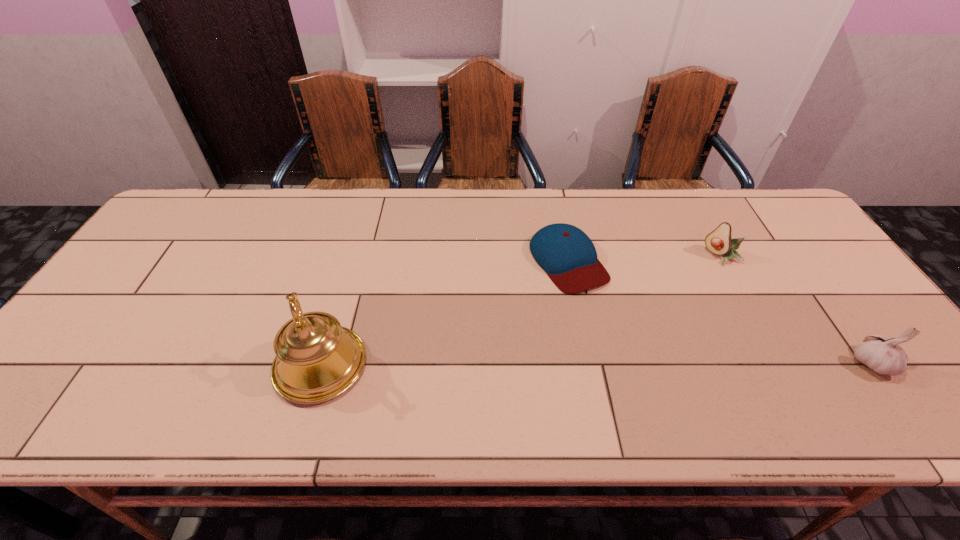
The width and height of the screenshot is (960, 540). I want to click on free location located on the seed side of the avocado, so click(669, 299).

The image size is (960, 540). I want to click on vacant space located 0.120m with the bill of the baseball cap facing forward, so click(615, 327).

You are a GUI agent. You are given a task and a screenshot of the screen. Output one action in this format:
    pyautogui.click(x=<x>, y=<y>)
    Task: Click on the vacant space located 0.200m with the bill of the baseball cap facing forward
    Image resolution: width=960 pixels, height=540 pixels.
    Given the screenshot: What is the action you would take?
    pyautogui.click(x=635, y=352)

The width and height of the screenshot is (960, 540). I want to click on free location located 0.050m with the bill of the baseball cap facing forward, so click(600, 306).

At what (x,y) coordinates should I click in order to perform the action: click on object located in the far edge section of the desktop. Please return your answer as a coordinate pair (x, y). Image resolution: width=960 pixels, height=540 pixels. Looking at the image, I should click on (568, 256).

Find the location of a particular element. The width and height of the screenshot is (960, 540). bell that is at the near edge is located at coordinates (317, 359).

The height and width of the screenshot is (540, 960). In order to click on garlic that is at the near edge in this screenshot , I will do `click(884, 356)`.

The height and width of the screenshot is (540, 960). I want to click on object that is at the right edge, so click(x=884, y=356).

Locate an element on the screen. object positioned at the near right corner is located at coordinates (884, 356).

The height and width of the screenshot is (540, 960). In the image, there is a desktop. Identify the location of vacant space at the far edge. (510, 231).